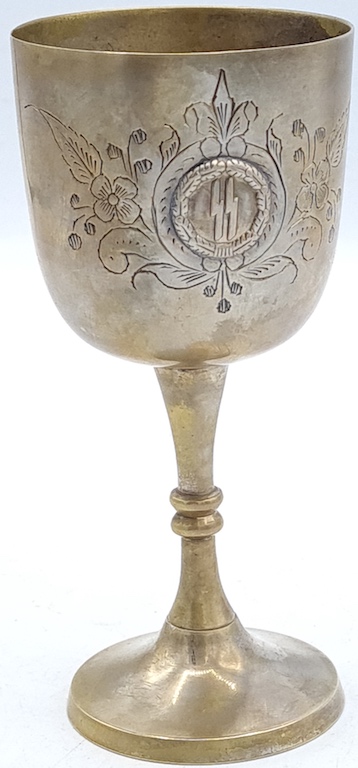
Where is `base of the gold goblet`? Image resolution: width=358 pixels, height=768 pixels. base of the gold goblet is located at coordinates (261, 697).